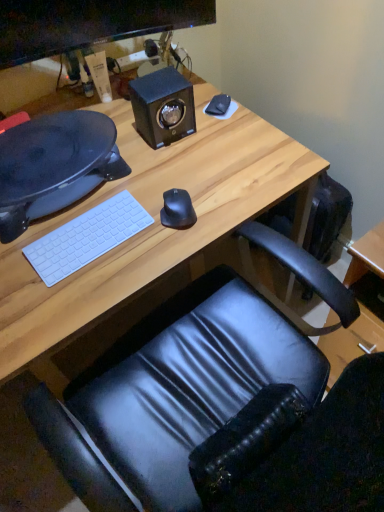
Where is `vacant space behind white matte keyboard at lower left`? Image resolution: width=384 pixels, height=512 pixels. vacant space behind white matte keyboard at lower left is located at coordinates (109, 189).